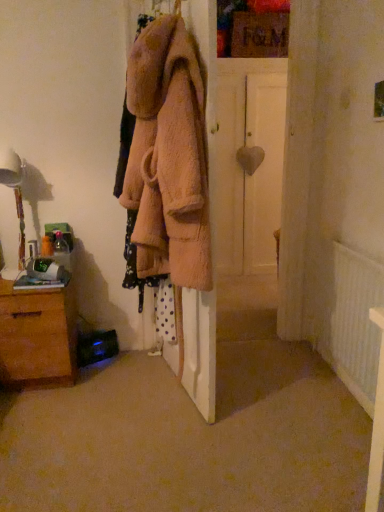
The image size is (384, 512). In order to click on vacant space in front of white textured radiator at lower right in this screenshot , I will do `click(326, 433)`.